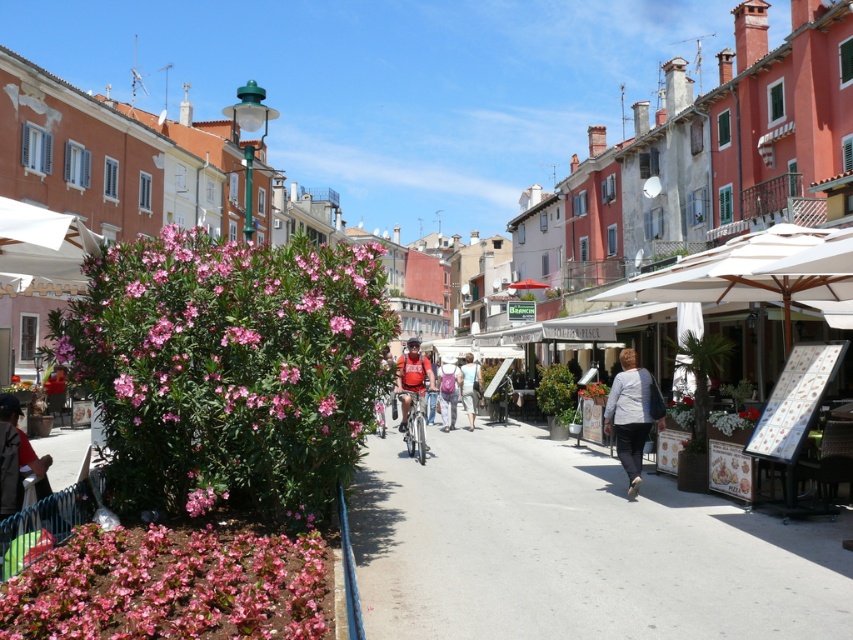
Question: Can you confirm if matte red shirt at center is positioned above matte pink backpack at center?

Choices:
 (A) yes
 (B) no

Answer: (A)

Question: Which object is the closest to the matte pink backpack at center?

Choices:
 (A) matte red backpack at center
 (B) white fabric canopy at upper left
 (C) pink matte flowers at lower left

Answer: (A)

Question: Can you confirm if pink matte flowers at lower left is thinner than white matte jacket at lower right?

Choices:
 (A) no
 (B) yes

Answer: (A)

Question: Which object is positioned closest to the white fabric canopy at upper left?

Choices:
 (A) pink matte flower at center
 (B) matte red shirt at center

Answer: (B)

Question: Does pink matte flowers at lower left lie in front of matte red backpack at center?

Choices:
 (A) no
 (B) yes

Answer: (B)

Question: Which point appears closest to the camera in this image?

Choices:
 (A) (480, 378)
 (B) (412, 353)
 (C) (206, 525)

Answer: (C)